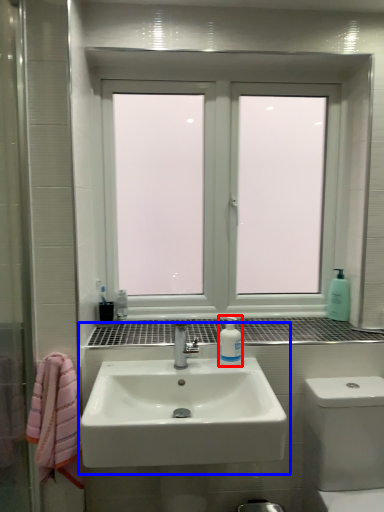
Question: Which object appears farthest to the camera in this image, mouthwash (highlighted by a red box) or sink (highlighted by a blue box)?

Choices:
 (A) mouthwash
 (B) sink

Answer: (A)